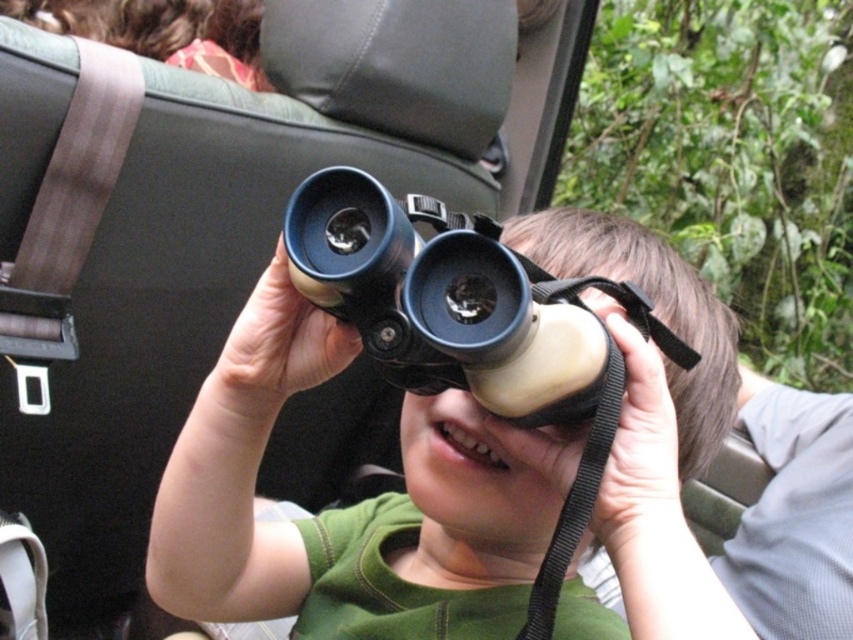
Question: Does matte black binoculars at center appear on the right side of black rubber binoculars at center?

Choices:
 (A) yes
 (B) no

Answer: (B)

Question: Is the position of matte black binoculars at center more distant than that of black rubber binoculars at center?

Choices:
 (A) no
 (B) yes

Answer: (B)

Question: Which point appears closest to the camera in this image?

Choices:
 (A) (314, 195)
 (B) (265, 556)

Answer: (A)

Question: Which point appears closest to the camera in this image?

Choices:
 (A) tap(573, 460)
 (B) tap(437, 356)

Answer: (B)

Question: Is matte black binoculars at center further to the viewer compared to black rubber binoculars at center?

Choices:
 (A) no
 (B) yes

Answer: (B)